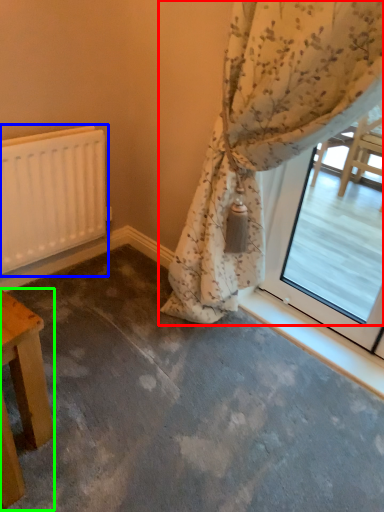
Question: Estimate the real-world distances between objects in this image. Which object is farther from curtain (highlighted by a red box), radiator (highlighted by a blue box) or table (highlighted by a green box)?

Choices:
 (A) radiator
 (B) table

Answer: (B)